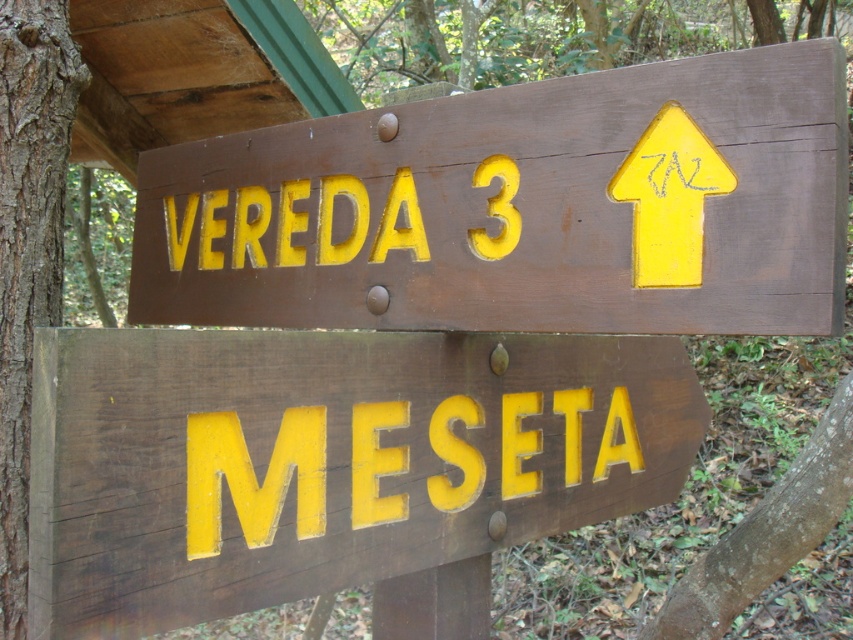
Between point (322, 400) and point (18, 168), which one is positioned behind?

Point (18, 168)

Who is shorter, matte wood sign at center or brown rough bark at left?

With less height is matte wood sign at center.

Describe the element at coordinates (325, 460) in the screenshot. I see `matte wood sign at center` at that location.

The width and height of the screenshot is (853, 640). I want to click on matte wood sign at center, so click(x=325, y=460).

Which is above, matte brown sign at upper center or brown rough bark at left?

matte brown sign at upper center is above.

Does point (753, 218) lie behind point (49, 250)?

No, (753, 218) is in front of (49, 250).

What are the coordinates of `matte brown sign at upper center` in the screenshot? It's located at (520, 208).

Where is `matte brown sign at upper center`? The width and height of the screenshot is (853, 640). matte brown sign at upper center is located at coordinates (520, 208).

Is point (751, 65) closer to viewer compared to point (404, 550)?

Yes.

Locate an element on the screen. Image resolution: width=853 pixels, height=640 pixels. matte brown sign at upper center is located at coordinates (520, 208).